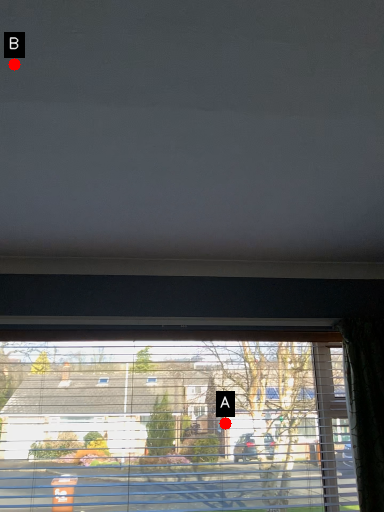
Question: Two points are circled on the image, labeled by A and B beside each circle. Which of the following is the farthest from the observer?

Choices:
 (A) A is further
 (B) B is further

Answer: (A)